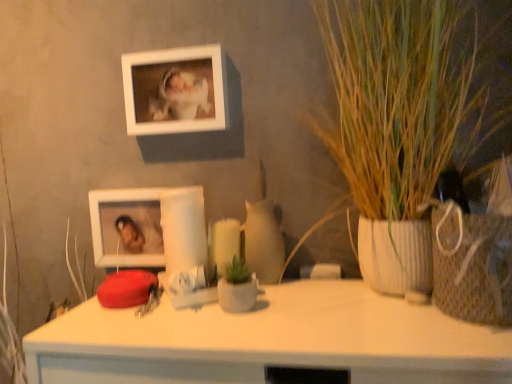
Question: In terms of size, does matte white candle at center appear bigger or smaller than white matte picture frame at upper center, marked as the second picture frame in a bottom-to-top arrangement?

Choices:
 (A) big
 (B) small

Answer: (B)

Question: Is matte white candle at center taller or shorter than white matte picture frame at upper center, the 1th picture frame from the top?

Choices:
 (A) short
 (B) tall

Answer: (A)

Question: Considering the real-world distances, which object is closest to the white matte picture frame at upper center, marked as the second picture frame in a bottom-to-top arrangement?

Choices:
 (A) matte white candle at center
 (B) white glossy picture frame at lower left, acting as the second picture frame starting from the top
 (C) green textured plant at right

Answer: (B)

Question: Which object is positioned closest to the green textured plant at right?

Choices:
 (A) white matte picture frame at upper center, the 1th picture frame from the top
 (B) matte white candle at center
 (C) white glossy picture frame at lower left, marked as the first picture frame in a bottom-to-top arrangement

Answer: (A)